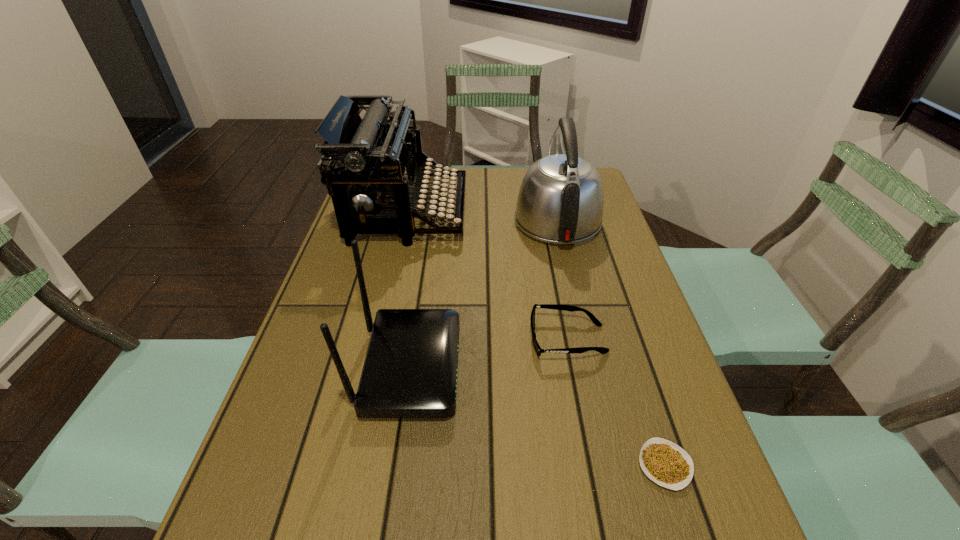
The width and height of the screenshot is (960, 540). In order to click on typewriter in this screenshot , I will do `click(373, 159)`.

The image size is (960, 540). What are the coordinates of `kettle` in the screenshot? It's located at (560, 201).

You are a GUI agent. You are given a task and a screenshot of the screen. Output one action in this format:
    pyautogui.click(x=<x>, y=<y>)
    Task: Click on the third tallest object
    This screenshot has width=960, height=540.
    Given the screenshot: What is the action you would take?
    coord(410,370)

You are a GUI agent. You are given a task and a screenshot of the screen. Output one action in this format:
    pyautogui.click(x=<x>, y=<y>)
    Task: Click on the sunglasses
    This screenshot has width=960, height=540.
    Given the screenshot: What is the action you would take?
    pyautogui.click(x=602, y=350)

You are a GUI agent. You are given a task and a screenshot of the screen. Output one action in this format:
    pyautogui.click(x=<x>, y=<y>)
    Task: Click on the shortest object
    
    Given the screenshot: What is the action you would take?
    pyautogui.click(x=664, y=462)

Image resolution: width=960 pixels, height=540 pixels. In order to click on the nearest object in this screenshot , I will do `click(664, 462)`.

Identify the location of vacant space located on the typing side of the typewriter. Image resolution: width=960 pixels, height=540 pixels. (519, 212).

At what (x,y) coordinates should I click in order to perform the action: click on vacant region located 0.140m on the spout of the kettle. Please return your answer as a coordinate pair (x, y). Looking at the image, I should click on (545, 172).

Image resolution: width=960 pixels, height=540 pixels. In order to click on free space located on the spout of the kettle in this screenshot , I will do `click(546, 173)`.

Locate an element on the screen. The image size is (960, 540). free spot located on the spout of the kettle is located at coordinates (546, 174).